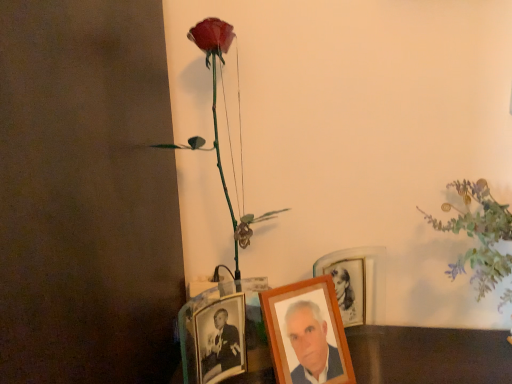
At what (x,y) coordinates should I click in order to perform the action: click on shiny plastic rose at upper left, positioned as the first floral arrangement in left-to-right order. Please return your answer as a coordinate pair (x, y). The image size is (512, 384). Looking at the image, I should click on (216, 117).

Measure the distance between metallic photo frame at lower center, placed as the third picture frame when sorted from right to left, and camera.

The distance of metallic photo frame at lower center, placed as the third picture frame when sorted from right to left, from camera is 28.27 inches.

This screenshot has width=512, height=384. I want to click on wooden photo frame at center, the third picture frame when ordered from left to right, so click(357, 282).

How much space does wooden photo frame at center, the third picture frame when ordered from left to right, occupy vertically?

6.93 inches.

Describe the element at coordinates (479, 235) in the screenshot. This screenshot has width=512, height=384. I see `matte green plant at upper right, arranged as the 1th floral arrangement when viewed from the right` at that location.

Locate an element on the screen. shiny plastic rose at upper left, positioned as the first floral arrangement in left-to-right order is located at coordinates (216, 117).

Looking at this image, is metallic photo frame at lower center, positioned as the 1th picture frame in left-to-right order, beside shiny plastic rose at upper left, the second floral arrangement when ordered from right to left?

No, metallic photo frame at lower center, positioned as the 1th picture frame in left-to-right order, is not next to shiny plastic rose at upper left, the second floral arrangement when ordered from right to left.

From the image's perspective, is metallic photo frame at lower center, positioned as the 1th picture frame in left-to-right order, beneath shiny plastic rose at upper left, the second floral arrangement when ordered from right to left?

Yes.

Who is more distant, metallic photo frame at lower center, placed as the third picture frame when sorted from right to left, or shiny plastic rose at upper left, positioned as the first floral arrangement in left-to-right order?

shiny plastic rose at upper left, positioned as the first floral arrangement in left-to-right order, is further from the camera.

From the image's perspective, is wooden photo frame at center, the second picture frame viewed from the right, above or below wooden photo frame at center, which appears as the 1th picture frame when viewed from the right?

wooden photo frame at center, the second picture frame viewed from the right, is situated lower than wooden photo frame at center, which appears as the 1th picture frame when viewed from the right, in the image.

Does point (316, 348) lie in front of point (367, 260)?

Yes, it is in front of point (367, 260).

Which of these two, wooden photo frame at center, the second picture frame viewed from the right, or wooden photo frame at center, the third picture frame when ordered from left to right, stands shorter?

Standing shorter between the two is wooden photo frame at center, the third picture frame when ordered from left to right.

Would you consider wooden photo frame at center, the 2th picture frame in the left-to-right sequence, to be distant from wooden photo frame at center, the third picture frame when ordered from left to right?

wooden photo frame at center, the 2th picture frame in the left-to-right sequence, is actually quite close to wooden photo frame at center, the third picture frame when ordered from left to right.

In terms of height, does shiny plastic rose at upper left, positioned as the first floral arrangement in left-to-right order, look taller or shorter compared to matte green plant at upper right, the 2th floral arrangement from the left?

Considering their sizes, shiny plastic rose at upper left, positioned as the first floral arrangement in left-to-right order, has more height than matte green plant at upper right, the 2th floral arrangement from the left.

Between shiny plastic rose at upper left, the second floral arrangement when ordered from right to left, and matte green plant at upper right, arranged as the 1th floral arrangement when viewed from the right, which one has smaller width?

shiny plastic rose at upper left, the second floral arrangement when ordered from right to left.

From a real-world perspective, who is located lower, shiny plastic rose at upper left, positioned as the first floral arrangement in left-to-right order, or matte green plant at upper right, arranged as the 1th floral arrangement when viewed from the right?

From a 3D spatial view, matte green plant at upper right, arranged as the 1th floral arrangement when viewed from the right, is below.

Can you tell me how much shiny plastic rose at upper left, positioned as the first floral arrangement in left-to-right order, and matte green plant at upper right, arranged as the 1th floral arrangement when viewed from the right, differ in facing direction?

shiny plastic rose at upper left, positioned as the first floral arrangement in left-to-right order, and matte green plant at upper right, arranged as the 1th floral arrangement when viewed from the right, are facing 1.61 degrees away from each other.

From the image's perspective, does metallic photo frame at lower center, positioned as the 1th picture frame in left-to-right order, appear lower than matte green plant at upper right, arranged as the 1th floral arrangement when viewed from the right?

Indeed, from the image's perspective, metallic photo frame at lower center, positioned as the 1th picture frame in left-to-right order, is shown beneath matte green plant at upper right, arranged as the 1th floral arrangement when viewed from the right.

Is there a large distance between metallic photo frame at lower center, positioned as the 1th picture frame in left-to-right order, and matte green plant at upper right, the 2th floral arrangement from the left?

No.

What's the angular difference between metallic photo frame at lower center, positioned as the 1th picture frame in left-to-right order, and matte green plant at upper right, the 2th floral arrangement from the left,'s facing directions?

The facing directions of metallic photo frame at lower center, positioned as the 1th picture frame in left-to-right order, and matte green plant at upper right, the 2th floral arrangement from the left, are 49.4 degrees apart.

Is point (215, 364) positioned before point (467, 186)?

Yes, it is.

Which point is more distant from viewer, (x=265, y=279) or (x=330, y=370)?

The point (x=265, y=279) is farther.

Which of these two, metallic photo frame at lower center, placed as the third picture frame when sorted from right to left, or wooden photo frame at center, the second picture frame viewed from the right, stands taller?

Standing taller between the two is wooden photo frame at center, the second picture frame viewed from the right.

Looking at this image, is metallic photo frame at lower center, placed as the third picture frame when sorted from right to left, in front of or behind wooden photo frame at center, the second picture frame viewed from the right, in the image?

In the image, metallic photo frame at lower center, placed as the third picture frame when sorted from right to left, appears in front of wooden photo frame at center, the second picture frame viewed from the right.

Does metallic photo frame at lower center, positioned as the 1th picture frame in left-to-right order, have a larger size compared to wooden photo frame at center, the second picture frame viewed from the right?

Yes.

At what (x,y) coordinates should I click in order to perform the action: click on floral arrangement on the right of wooden photo frame at center, the 2th picture frame in the left-to-right sequence. Please return your answer as a coordinate pair (x, y). Looking at the image, I should click on (479, 235).

Is point (495, 250) closer or farther from the camera than point (345, 382)?

Point (495, 250) appears to be closer to the viewer than point (345, 382).

Who is shorter, matte green plant at upper right, the 2th floral arrangement from the left, or wooden photo frame at center, the second picture frame viewed from the right?

wooden photo frame at center, the second picture frame viewed from the right, is shorter.

Is matte green plant at upper right, the 2th floral arrangement from the left, next to wooden photo frame at center, the 2th picture frame in the left-to-right sequence, and touching it?

No, matte green plant at upper right, the 2th floral arrangement from the left, is not with wooden photo frame at center, the 2th picture frame in the left-to-right sequence.

Is point (210, 31) closer to viewer compared to point (372, 287)?

Yes, point (210, 31) is in front of point (372, 287).

Is shiny plastic rose at upper left, positioned as the first floral arrangement in left-to-right order, aimed at wooden photo frame at center, the third picture frame when ordered from left to right?

No.

From a real-world perspective, who is located lower, shiny plastic rose at upper left, the second floral arrangement when ordered from right to left, or wooden photo frame at center, the third picture frame when ordered from left to right?

From a 3D spatial view, wooden photo frame at center, the third picture frame when ordered from left to right, is below.

Which of these two, shiny plastic rose at upper left, the second floral arrangement when ordered from right to left, or wooden photo frame at center, which appears as the 1th picture frame when viewed from the right, is smaller?

With smaller size is wooden photo frame at center, which appears as the 1th picture frame when viewed from the right.

Image resolution: width=512 pixels, height=384 pixels. In order to click on floral arrangement lying on the left of metallic photo frame at lower center, placed as the third picture frame when sorted from right to left in this screenshot , I will do `click(216, 117)`.

The height and width of the screenshot is (384, 512). In order to click on picture frame that is the 2nd one above the wooden photo frame at center, the third picture frame when ordered from left to right (from a real-world perspective) in this screenshot , I will do `click(307, 333)`.

Estimate the real-world distances between objects in this image. Which object is closer to metallic photo frame at lower center, positioned as the 1th picture frame in left-to-right order, shiny plastic rose at upper left, the second floral arrangement when ordered from right to left, or wooden photo frame at center, the third picture frame when ordered from left to right?

Based on the image, shiny plastic rose at upper left, the second floral arrangement when ordered from right to left, appears to be nearer to metallic photo frame at lower center, positioned as the 1th picture frame in left-to-right order.

From the image, which object appears to be farther from wooden photo frame at center, the third picture frame when ordered from left to right, matte green plant at upper right, arranged as the 1th floral arrangement when viewed from the right, or wooden photo frame at center, the 2th picture frame in the left-to-right sequence?

matte green plant at upper right, arranged as the 1th floral arrangement when viewed from the right, is positioned further to the anchor wooden photo frame at center, the third picture frame when ordered from left to right.

Considering their positions, is shiny plastic rose at upper left, the second floral arrangement when ordered from right to left, positioned further to wooden photo frame at center, the second picture frame viewed from the right, than wooden photo frame at center, which appears as the 1th picture frame when viewed from the right?

Answer: shiny plastic rose at upper left, the second floral arrangement when ordered from right to left, is positioned further to the anchor wooden photo frame at center, the second picture frame viewed from the right.

Which object lies nearer to the anchor point shiny plastic rose at upper left, positioned as the first floral arrangement in left-to-right order, wooden photo frame at center, the third picture frame when ordered from left to right, or matte green plant at upper right, arranged as the 1th floral arrangement when viewed from the right?

Based on the image, wooden photo frame at center, the third picture frame when ordered from left to right, appears to be nearer to shiny plastic rose at upper left, positioned as the first floral arrangement in left-to-right order.

Which object lies nearer to the anchor point wooden photo frame at center, the second picture frame viewed from the right, metallic photo frame at lower center, positioned as the 1th picture frame in left-to-right order, or matte green plant at upper right, arranged as the 1th floral arrangement when viewed from the right?

Among the two, metallic photo frame at lower center, positioned as the 1th picture frame in left-to-right order, is located nearer to wooden photo frame at center, the second picture frame viewed from the right.

Looking at the image, which one is located further to matte green plant at upper right, arranged as the 1th floral arrangement when viewed from the right, metallic photo frame at lower center, placed as the third picture frame when sorted from right to left, or wooden photo frame at center, the 2th picture frame in the left-to-right sequence?

The object further to matte green plant at upper right, arranged as the 1th floral arrangement when viewed from the right, is metallic photo frame at lower center, placed as the third picture frame when sorted from right to left.

Which object lies nearer to the anchor point wooden photo frame at center, the second picture frame viewed from the right, matte green plant at upper right, the 2th floral arrangement from the left, or metallic photo frame at lower center, positioned as the 1th picture frame in left-to-right order?

metallic photo frame at lower center, positioned as the 1th picture frame in left-to-right order, is positioned closer to the anchor wooden photo frame at center, the second picture frame viewed from the right.

Which object lies further to the anchor point wooden photo frame at center, the second picture frame viewed from the right, wooden photo frame at center, which appears as the 1th picture frame when viewed from the right, or matte green plant at upper right, the 2th floral arrangement from the left?

Among the two, matte green plant at upper right, the 2th floral arrangement from the left, is located further to wooden photo frame at center, the second picture frame viewed from the right.

Identify the location of picture frame between metallic photo frame at lower center, positioned as the 1th picture frame in left-to-right order, and wooden photo frame at center, which appears as the 1th picture frame when viewed from the right. This screenshot has height=384, width=512. (307, 333).

Locate an element on the screen. picture frame between shiny plastic rose at upper left, positioned as the first floral arrangement in left-to-right order, and wooden photo frame at center, the 2th picture frame in the left-to-right sequence, from top to bottom is located at coordinates (357, 282).

Locate an element on the screen. This screenshot has width=512, height=384. picture frame located between wooden photo frame at center, the second picture frame viewed from the right, and matte green plant at upper right, arranged as the 1th floral arrangement when viewed from the right, in the left-right direction is located at coordinates (357, 282).